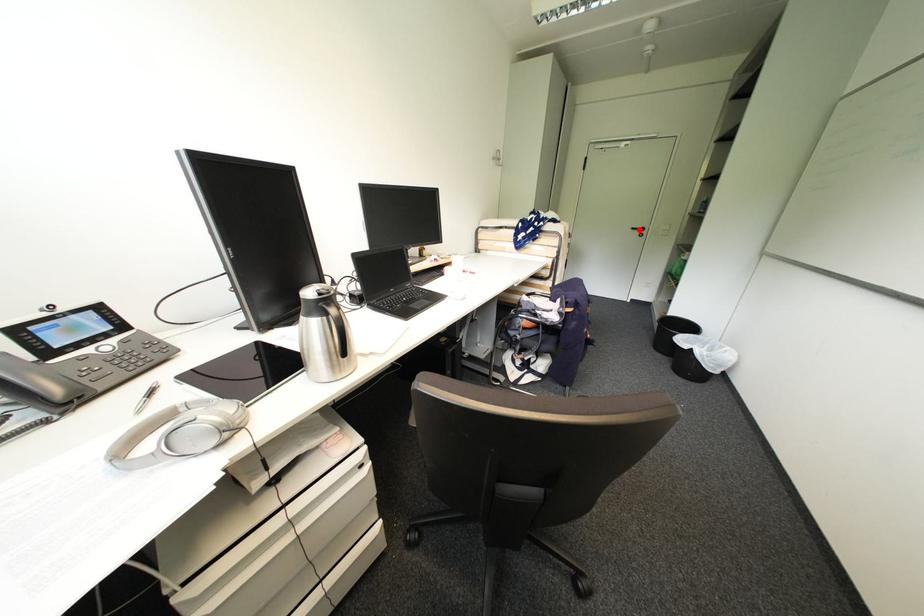
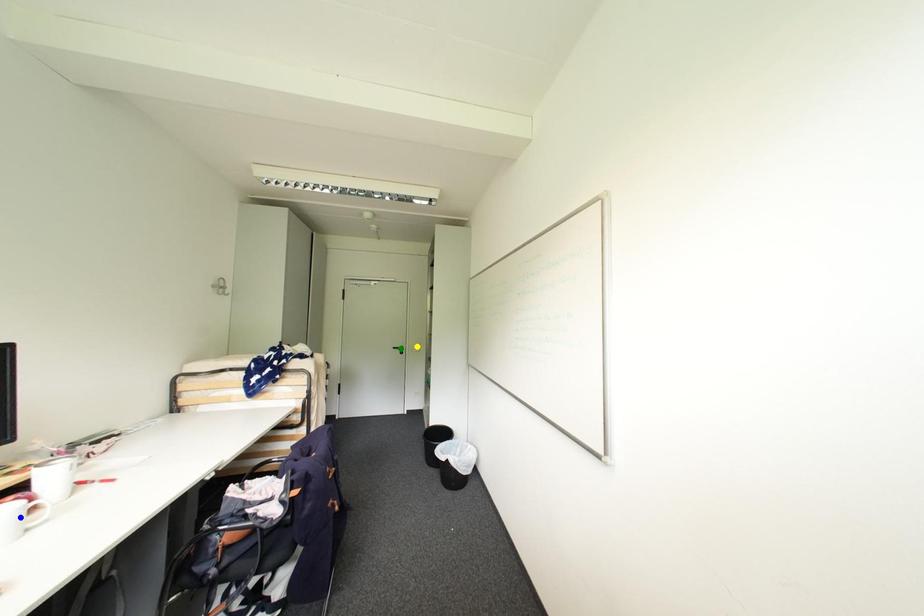
Question: I am providing you with two images of the same scene from different viewpoints. A red point is marked on the first image. You are given multiple points on the second image. Can you choose the point in image 2 that corresponds to the point in image 1?

Choices:
 (A) blue point
 (B) yellow point
 (C) green point

Answer: (C)